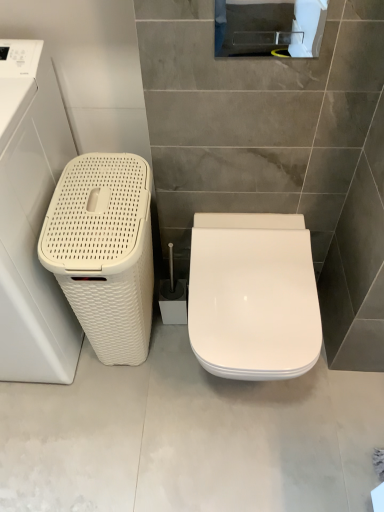
This screenshot has height=512, width=384. I want to click on free space in front of white woven basket at left, so click(x=123, y=412).